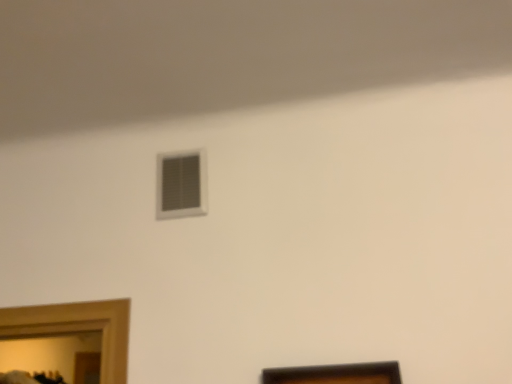
Question: Can you confirm if brown wooden picture frame at lower center is positioned to the left of white plastic vent at upper center?

Choices:
 (A) no
 (B) yes

Answer: (A)

Question: Could you tell me if brown wooden picture frame at lower center is facing white plastic vent at upper center?

Choices:
 (A) yes
 (B) no

Answer: (B)

Question: From a real-world perspective, is brown wooden picture frame at lower center located beneath white plastic vent at upper center?

Choices:
 (A) yes
 (B) no

Answer: (A)

Question: Is white plastic vent at upper center completely or partially inside brown wooden picture frame at lower center?

Choices:
 (A) yes
 (B) no

Answer: (B)

Question: Considering the relative sizes of brown wooden picture frame at lower center and white plastic vent at upper center in the image provided, is brown wooden picture frame at lower center taller than white plastic vent at upper center?

Choices:
 (A) yes
 (B) no

Answer: (A)

Question: Is brown wooden picture frame at lower center bigger than white plastic vent at upper center?

Choices:
 (A) yes
 (B) no

Answer: (A)

Question: Is white plastic vent at upper center in contact with brown wooden picture frame at lower center?

Choices:
 (A) no
 (B) yes

Answer: (A)

Question: From the image's perspective, is white plastic vent at upper center over brown wooden picture frame at lower center?

Choices:
 (A) yes
 (B) no

Answer: (A)

Question: Does white plastic vent at upper center appear on the left side of brown wooden picture frame at lower center?

Choices:
 (A) yes
 (B) no

Answer: (A)

Question: Is white plastic vent at upper center thinner than brown wooden picture frame at lower center?

Choices:
 (A) no
 (B) yes

Answer: (B)

Question: Can you confirm if white plastic vent at upper center is bigger than brown wooden picture frame at lower center?

Choices:
 (A) yes
 (B) no

Answer: (B)

Question: Is the position of white plastic vent at upper center less distant than that of brown wooden picture frame at lower center?

Choices:
 (A) yes
 (B) no

Answer: (B)

Question: In the image, is white plastic vent at upper center positioned in front of or behind brown wooden picture frame at lower center?

Choices:
 (A) behind
 (B) front

Answer: (A)